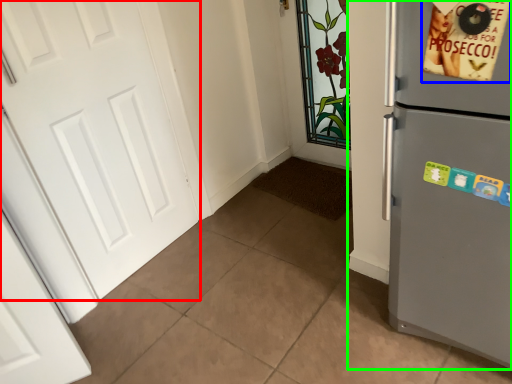
Question: Which object is positioned farthest from door (highlighted by a red box)? Select from postcard (highlighted by a blue box) and refrigerator (highlighted by a green box).

Choices:
 (A) postcard
 (B) refrigerator

Answer: (A)